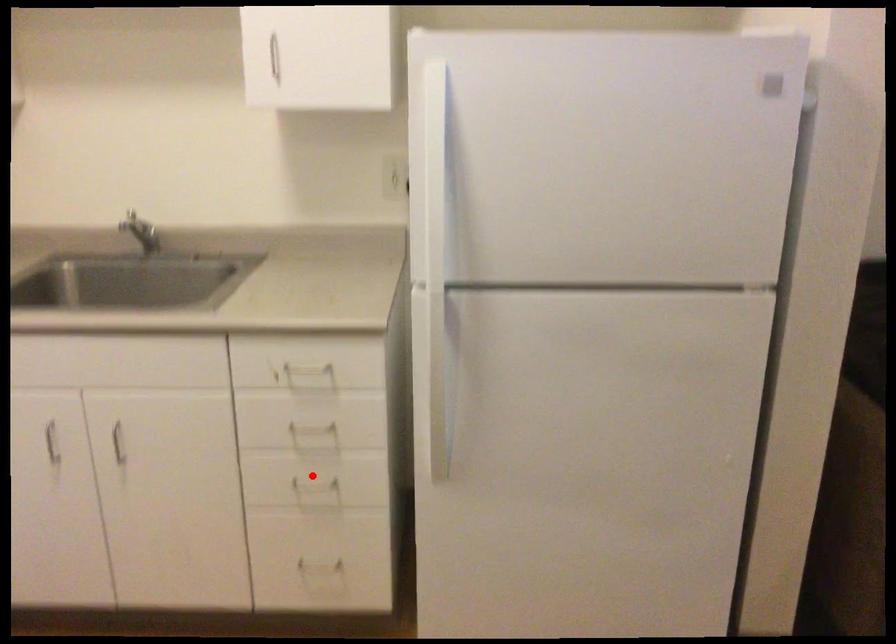
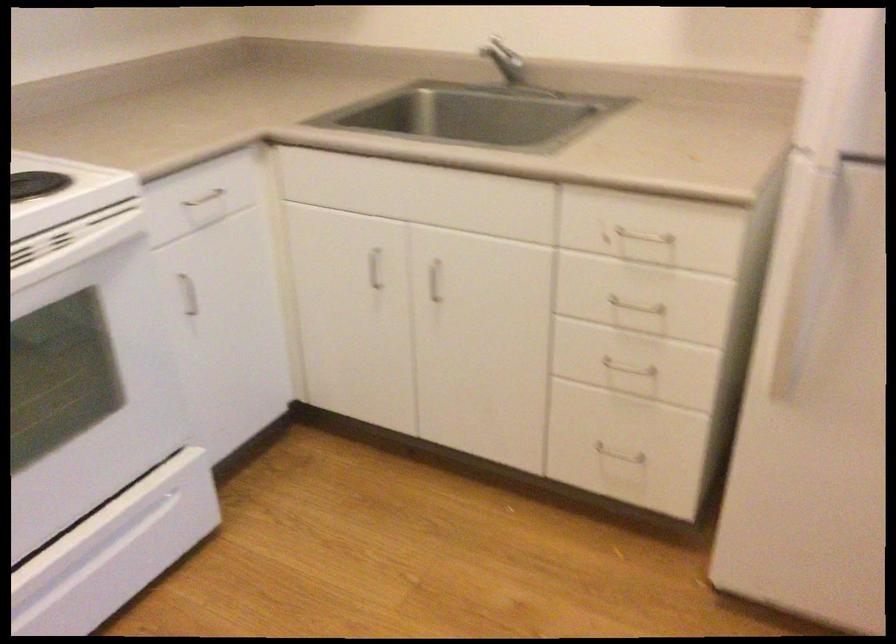
Where in the second image is the point corresponding to the highlighted location from the first image?

(624, 359)